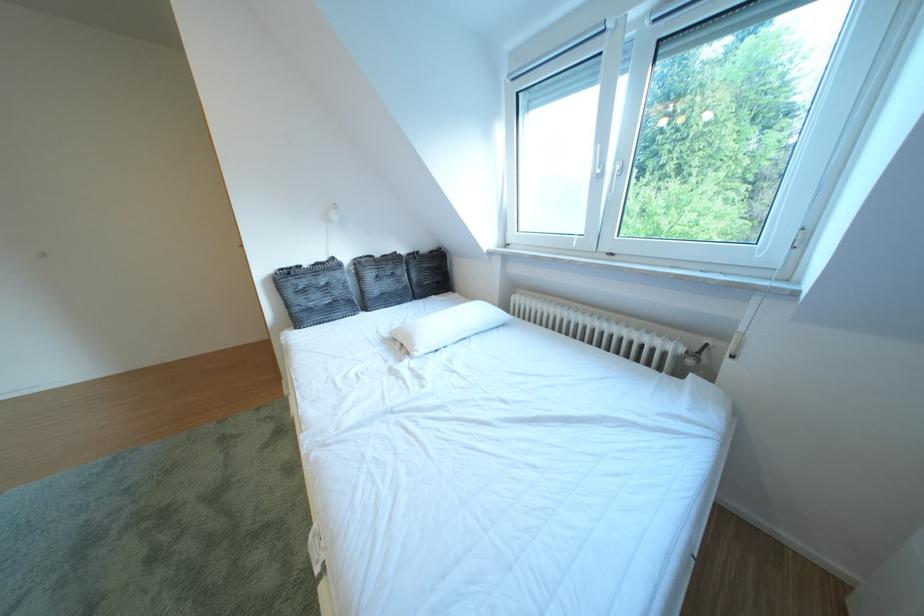
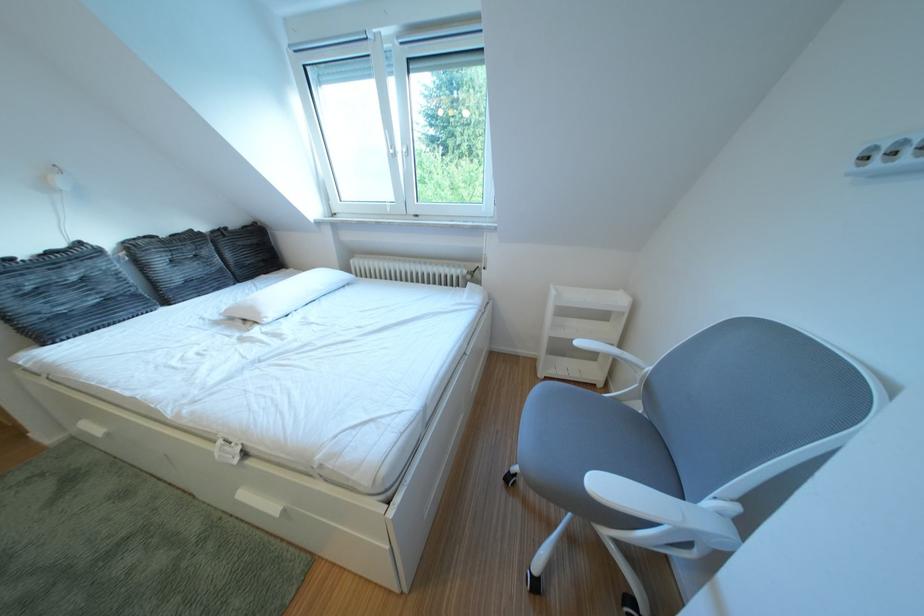
In the second image, find the point that corresponds to [346,264] in the first image.

(93, 249)